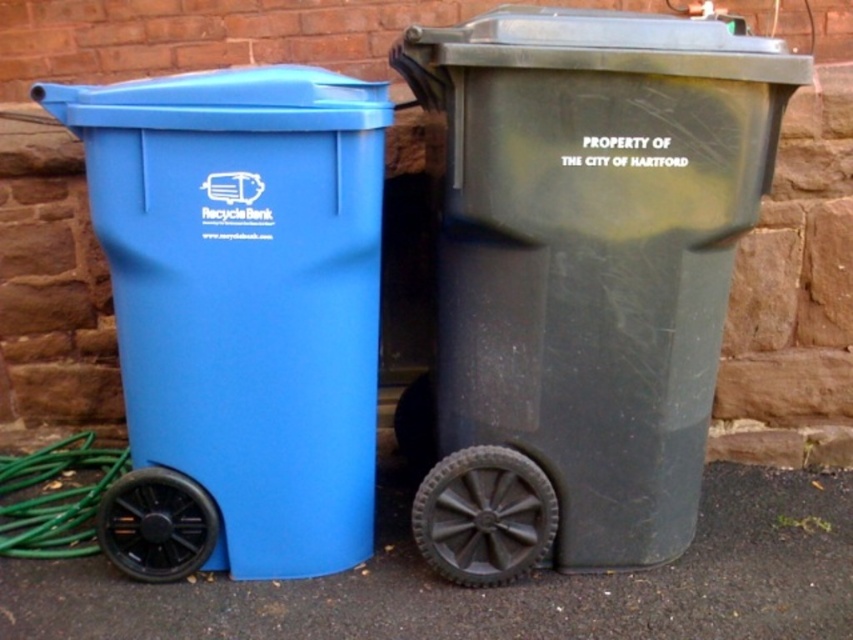
You are standing at the camera position and want to pick up an object located at point (529,202). Can you reach it without moving your feet?

The point (529,202) is 1.78 meters away from the camera. Since the average human arm length is about 0.7 meters, you cannot reach it without moving your feet.

You are a maintenance worker trying to replace the wheels of the trash bins. You notice two black rubber wheels in the scene. Which wheel is closer to you, the black rubber wheel at lower center or the black rubber wheel at lower left?

The black rubber wheel at lower center is closer to you than the black rubber wheel at lower left.

You are a delivery person trying to park your van between the matte black trash can at right and the green rubber garden hose at lower left. Can you fit the van there if the van is 2 meters wide?

The matte black trash can at right is located above the green rubber garden hose at lower left. Since they are positioned vertically, there is no horizontal space between them for the van to park. Therefore, the van cannot fit between them.